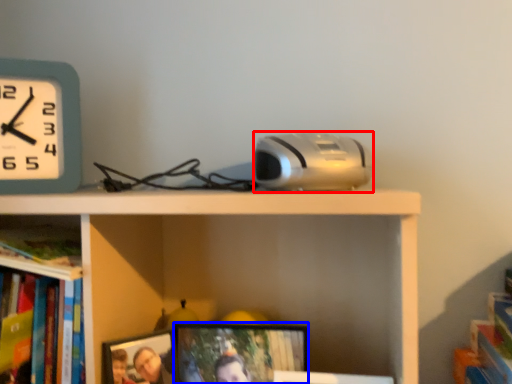
Question: Among these objects, which one is farthest to the camera, gadget (highlighted by a red box) or picture frame (highlighted by a blue box)?

Choices:
 (A) gadget
 (B) picture frame

Answer: (B)